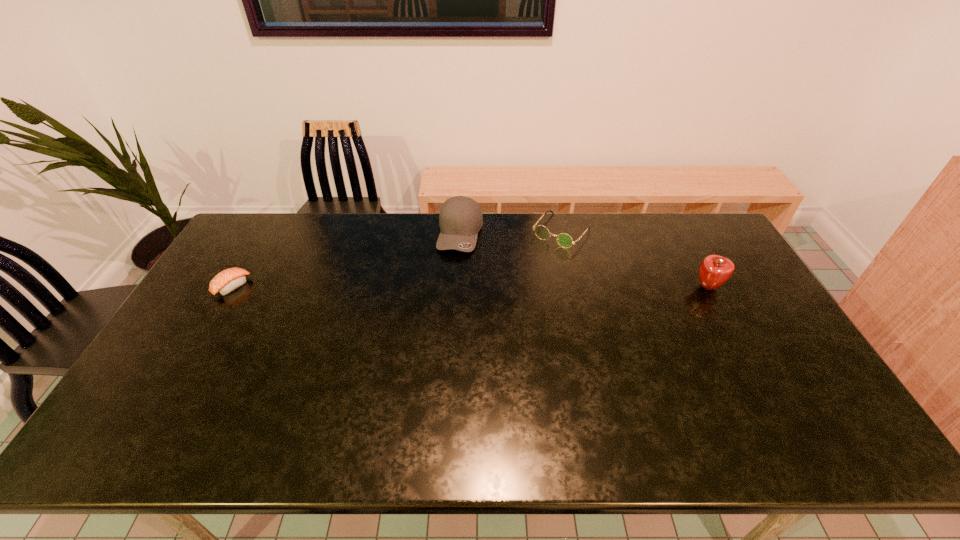
In the image, there is a desktop. At what (x,y) coordinates should I click in order to perform the action: click on vacant space at the left edge. Please return your answer as a coordinate pair (x, y). Image resolution: width=960 pixels, height=540 pixels. Looking at the image, I should click on (180, 375).

In the image, there is a desktop. Where is `free space at the far left corner`? The height and width of the screenshot is (540, 960). free space at the far left corner is located at coordinates (273, 214).

Identify the location of free space at the far right corner of the desktop. The image size is (960, 540). (688, 228).

In the image, there is a desktop. Where is `vacant space at the near right corner`? The height and width of the screenshot is (540, 960). vacant space at the near right corner is located at coordinates (795, 404).

This screenshot has height=540, width=960. I want to click on free space between the shortest object and the second shortest object, so click(x=397, y=259).

I want to click on free space between the baseball cap and the apple, so click(585, 260).

This screenshot has width=960, height=540. In order to click on unoccupied area between the rightmost object and the sushi in this screenshot , I will do `click(470, 287)`.

Identify the location of free space between the spectacles and the third object from right to left. (511, 232).

This screenshot has height=540, width=960. Find the location of `vacant space that is in between the shortest object and the apple`. vacant space that is in between the shortest object and the apple is located at coordinates (470, 287).

Locate an element on the screen. vacant region between the rightmost object and the third tallest object is located at coordinates (635, 259).